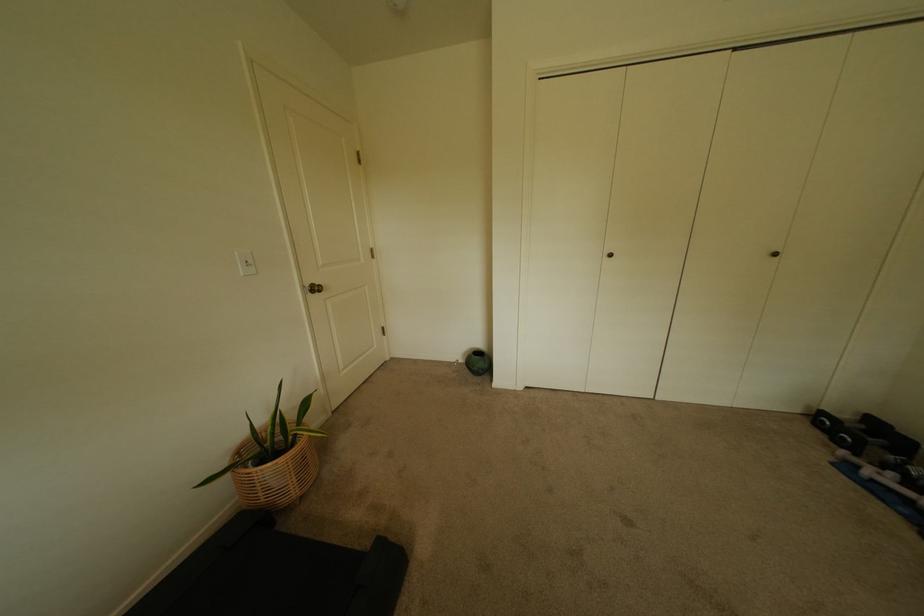
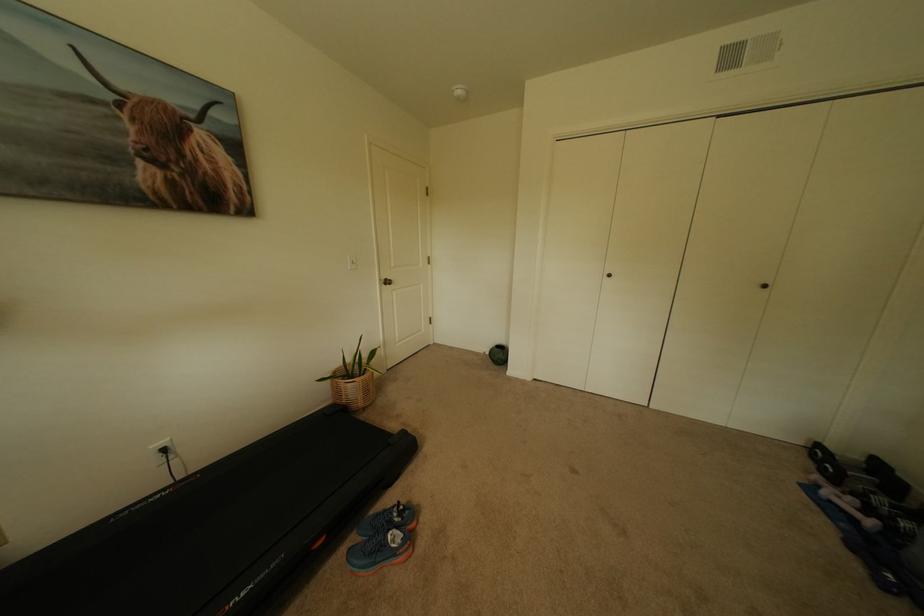
Question: The first image is from the beginning of the video and the second image is from the end. How did the camera likely rotate when shooting the video?

Choices:
 (A) Left
 (B) Right
 (C) Up
 (D) Down

Answer: (A)